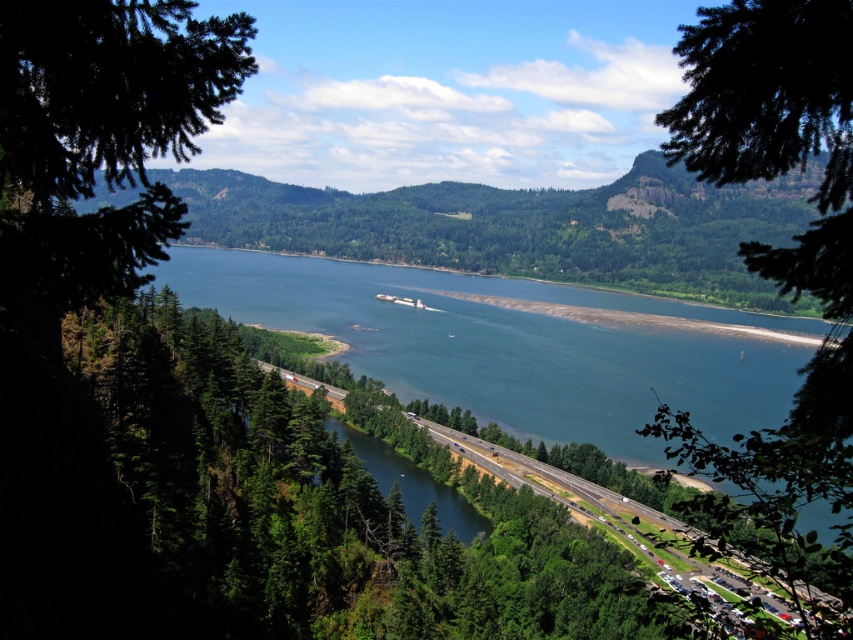
In the scene shown: Who is higher up, blue-green water at center or green leafy tree at upper center?

blue-green water at center is higher up.

Describe the element at coordinates (519, 344) in the screenshot. The height and width of the screenshot is (640, 853). I see `blue-green water at center` at that location.

Locate an element on the screen. blue-green water at center is located at coordinates (519, 344).

The image size is (853, 640). I want to click on blue-green water at center, so click(x=519, y=344).